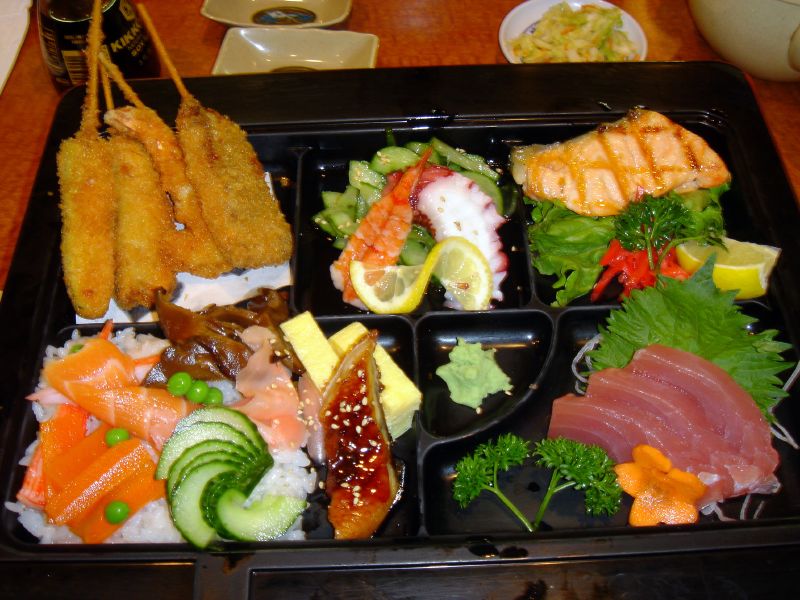
Image resolution: width=800 pixels, height=600 pixels. Identify the location of table. (433, 22).